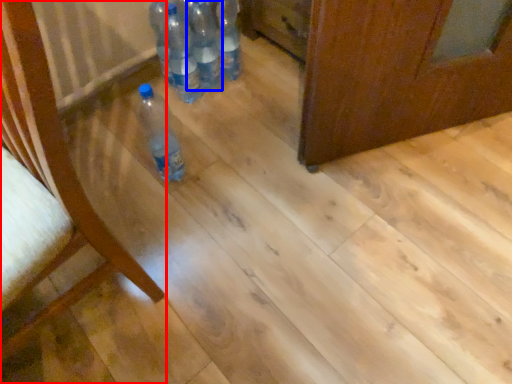
Question: Which of the following is the closest to the observer, furniture (highlighted by a red box) or bottle (highlighted by a blue box)?

Choices:
 (A) furniture
 (B) bottle

Answer: (A)